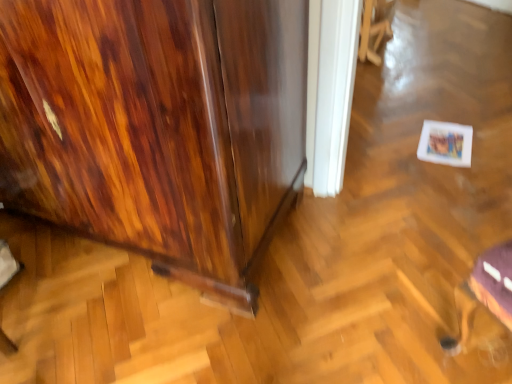
Question: Is wooden cabinet at left bigger or smaller than metallic silver swivel chair at lower right, arranged as the 2th swivel chair when viewed from the top?

Choices:
 (A) big
 (B) small

Answer: (A)

Question: Is wooden cabinet at left spatially inside metallic silver swivel chair at lower right, arranged as the 2th swivel chair when viewed from the top, or outside of it?

Choices:
 (A) inside
 (B) outside

Answer: (B)

Question: Which object is positioned farthest from the wooden swivel chair at upper center, the 2th swivel chair in the bottom-to-top sequence?

Choices:
 (A) metallic silver swivel chair at lower right, arranged as the 2th swivel chair when viewed from the top
 (B) wooden cabinet at left

Answer: (A)

Question: Which object is positioned farthest from the wooden swivel chair at upper center, acting as the 1th swivel chair starting from the back?

Choices:
 (A) wooden cabinet at left
 (B) metallic silver swivel chair at lower right, which is the first swivel chair in bottom-to-top order

Answer: (B)